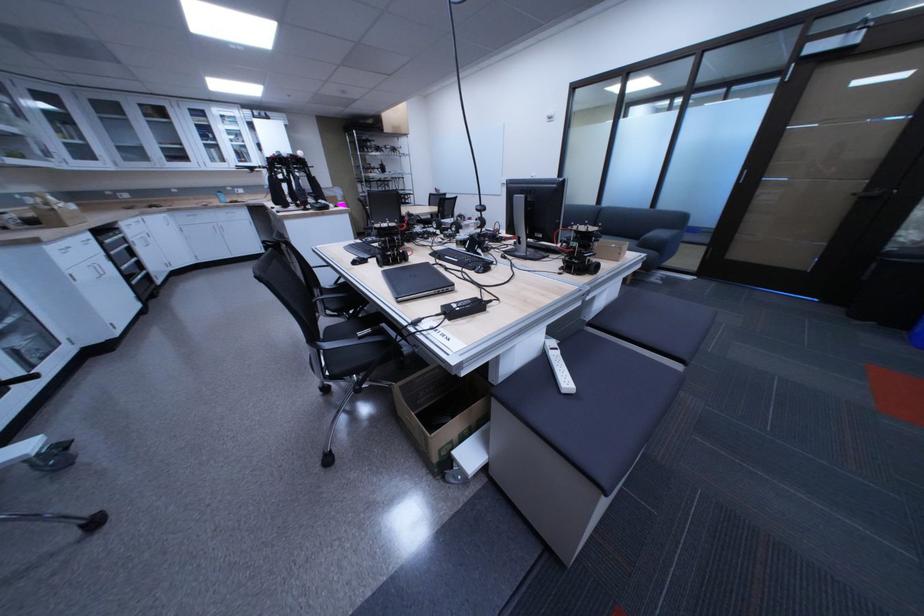
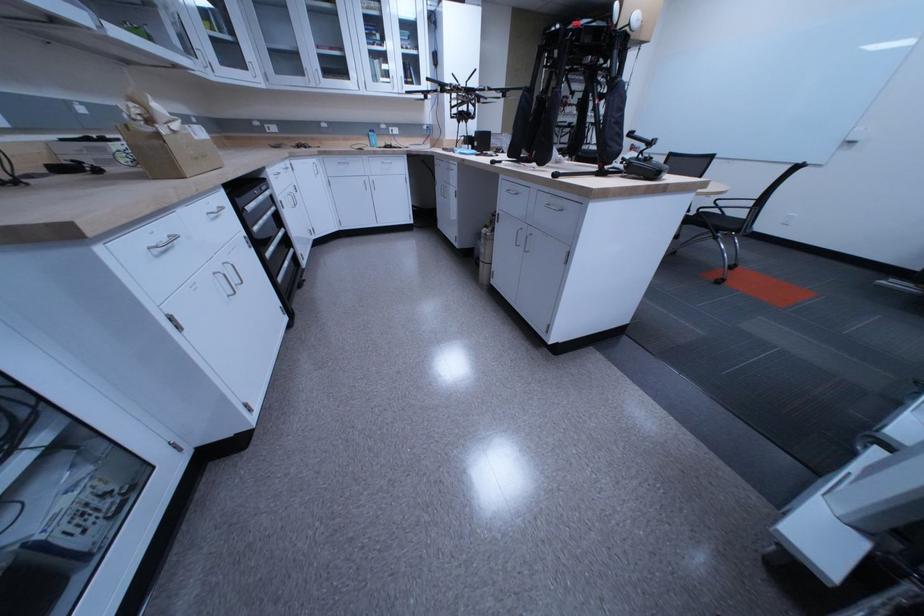
What movement of the cameraman would produce the second image?

The movement direction of the cameraman is left, forward.